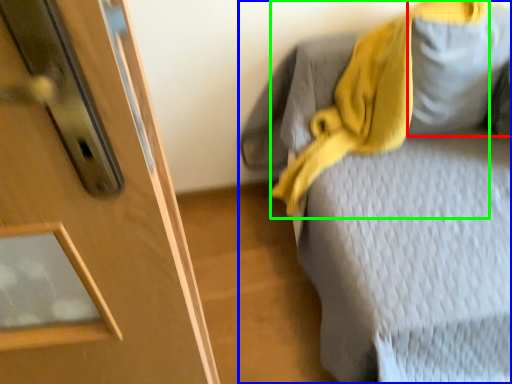
Question: Which object is positioned farthest from gray (highlighted by a red box)? Select from furniture (highlighted by a blue box) and scarf (highlighted by a green box).

Choices:
 (A) furniture
 (B) scarf

Answer: (A)